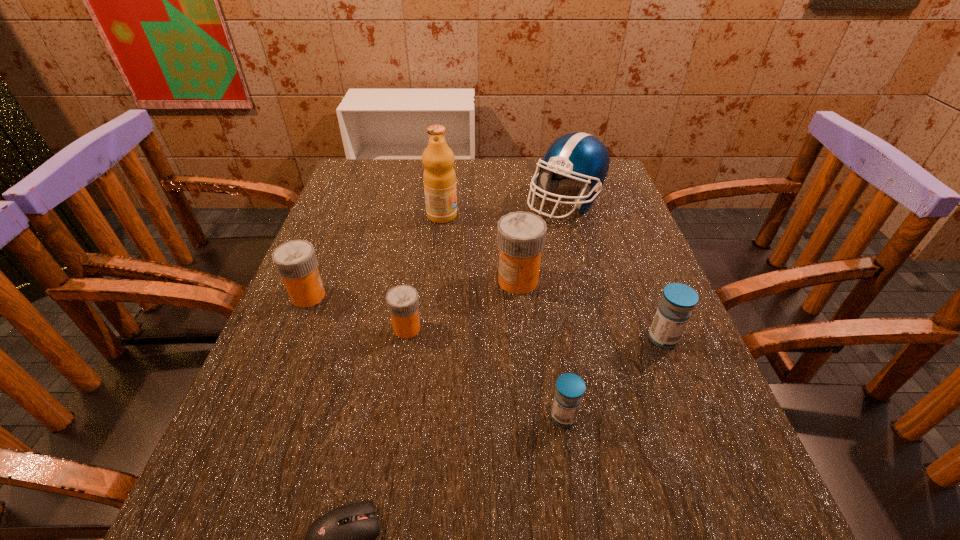
Image resolution: width=960 pixels, height=540 pixels. Identify the location of medicine that can be found as the second closest to the rightmost orange medicine. (678, 300).

Point out which orange medicine is positioned as the nearest to the tallest medicine. Please provide its 2D coordinates. Your answer should be formatted as a tuple, i.e. [(x, y)], where the tuple contains the x and y coordinates of a point satisfying the conditions above.

[(402, 301)]

Identify the location of orange medicine that can be found as the closest to the nearest orange medicine. (296, 262).

Identify the location of free spot that satisfies the following two spatial constraints: 1. on the label side of the smaller blue medicine; 2. on the right side of the leftmost object. The width and height of the screenshot is (960, 540). (258, 417).

The image size is (960, 540). I want to click on free region that satisfies the following two spatial constraints: 1. on the label side of the fourth medicine from right to left; 2. on the right side of the farther blue medicine, so click(x=405, y=339).

Where is `vacant space that satisfies the following two spatial constraints: 1. at the front of the second tallest object with the faceguard; 2. on the label side of the smallest orange medicine`? vacant space that satisfies the following two spatial constraints: 1. at the front of the second tallest object with the faceguard; 2. on the label side of the smallest orange medicine is located at coordinates (599, 328).

This screenshot has height=540, width=960. Identify the location of free space in the image that satisfies the following two spatial constraints: 1. on the label side of the second biggest orange medicine; 2. on the right side of the rightmost medicine. (291, 339).

What are the coordinates of `free space that satisfies the following two spatial constraints: 1. on the label side of the nearest medicine; 2. on the left side of the nearest orange medicine` in the screenshot? It's located at (393, 417).

Find the location of a particular element. vacant region that satisfies the following two spatial constraints: 1. at the front of the second tallest object with the faceguard; 2. on the label side of the leftmost object is located at coordinates (590, 296).